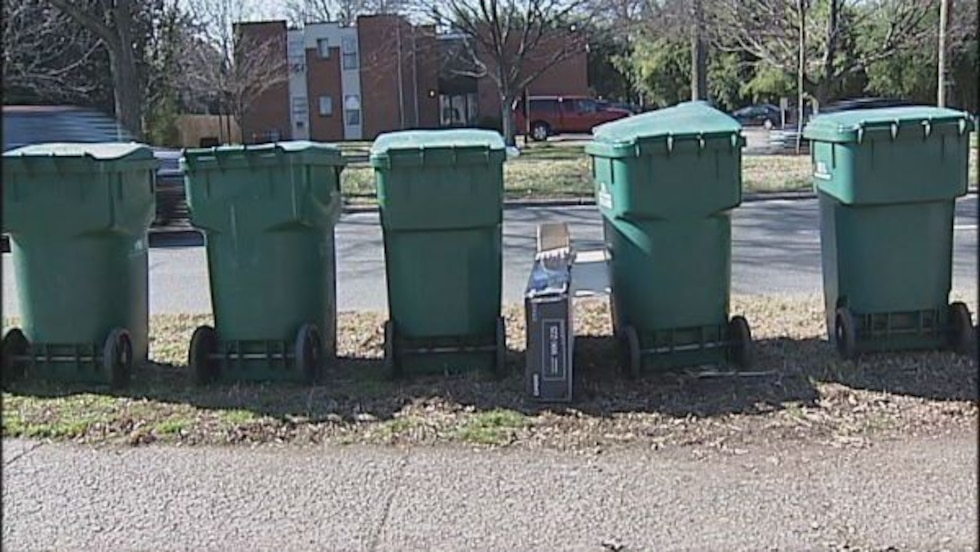
Find the location of a particular element. garbage cans is located at coordinates (x=75, y=216), (x=259, y=201), (x=417, y=197), (x=664, y=188), (x=889, y=172).